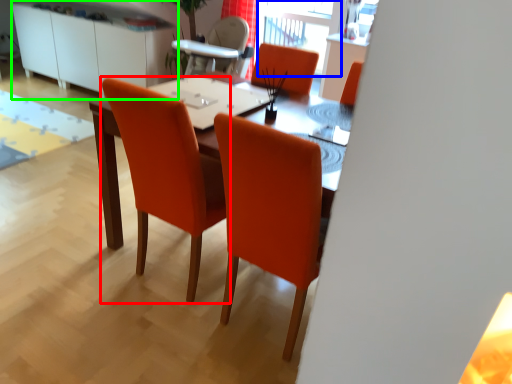
Question: Considering the real-world distances, which object is closest to chair (highlighted by a red box)? window screen (highlighted by a blue box) or dresser (highlighted by a green box).

Choices:
 (A) window screen
 (B) dresser

Answer: (A)